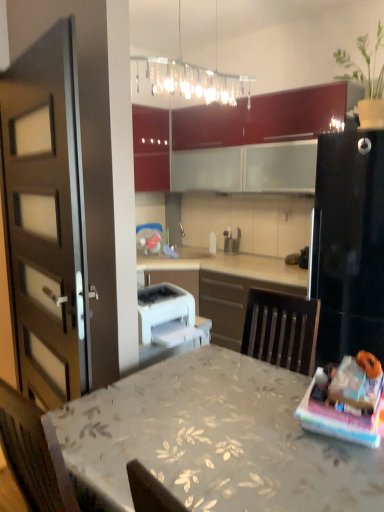
Question: Does glossy wood cabinets at upper center, which appears as the first cabinetry when viewed from the right, have a larger size compared to green matte plant at upper right?

Choices:
 (A) no
 (B) yes

Answer: (B)

Question: Considering the relative positions of glossy wood cabinets at upper center, which is the second cabinetry in left-to-right order, and green matte plant at upper right in the image provided, is glossy wood cabinets at upper center, which is the second cabinetry in left-to-right order, to the left of green matte plant at upper right from the viewer's perspective?

Choices:
 (A) yes
 (B) no

Answer: (A)

Question: Does glossy wood cabinets at upper center, which appears as the first cabinetry when viewed from the right, have a lesser width compared to green matte plant at upper right?

Choices:
 (A) no
 (B) yes

Answer: (A)

Question: From the image's perspective, does glossy wood cabinets at upper center, which appears as the first cabinetry when viewed from the right, appear lower than green matte plant at upper right?

Choices:
 (A) yes
 (B) no

Answer: (A)

Question: Considering the relative positions of glossy wood cabinets at upper center, which appears as the first cabinetry when viewed from the right, and green matte plant at upper right in the image provided, is glossy wood cabinets at upper center, which appears as the first cabinetry when viewed from the right, in front of green matte plant at upper right?

Choices:
 (A) no
 (B) yes

Answer: (A)

Question: Is glossy wood cabinets at upper center, which appears as the first cabinetry when viewed from the right, not within green matte plant at upper right?

Choices:
 (A) yes
 (B) no

Answer: (A)

Question: Is white plastic printer at center, the 1th appliance from the left, at the right side of clear glass light fixture at upper center?

Choices:
 (A) yes
 (B) no

Answer: (B)

Question: From a real-world perspective, does white plastic printer at center, placed as the second appliance when sorted from right to left, stand above clear glass light fixture at upper center?

Choices:
 (A) yes
 (B) no

Answer: (B)

Question: Is white plastic printer at center, the 1th appliance positioned from the bottom, not close to clear glass light fixture at upper center?

Choices:
 (A) no
 (B) yes

Answer: (B)

Question: Is the depth of white plastic printer at center, marked as the 1th appliance in a front-to-back arrangement, greater than that of clear glass light fixture at upper center?

Choices:
 (A) yes
 (B) no

Answer: (A)

Question: Is white plastic printer at center, which ranks as the second appliance in top-to-bottom order, shorter than clear glass light fixture at upper center?

Choices:
 (A) no
 (B) yes

Answer: (B)

Question: Considering the relative sizes of white plastic printer at center, marked as the 1th appliance in a front-to-back arrangement, and clear glass light fixture at upper center in the image provided, is white plastic printer at center, marked as the 1th appliance in a front-to-back arrangement, taller than clear glass light fixture at upper center?

Choices:
 (A) no
 (B) yes

Answer: (A)

Question: Considering the relative sizes of green matte plant at upper right and white plastic printer at center, placed as the second appliance when sorted from right to left, in the image provided, is green matte plant at upper right smaller than white plastic printer at center, placed as the second appliance when sorted from right to left,?

Choices:
 (A) yes
 (B) no

Answer: (B)